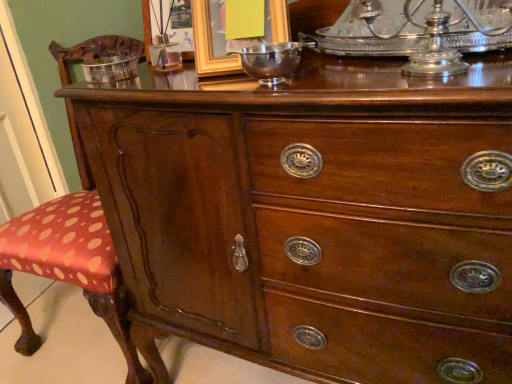
Image resolution: width=512 pixels, height=384 pixels. What are the coordinates of `vacant region in front of metallic gold picture frame at upper center, the second picture frame from the right` in the screenshot? It's located at (156, 84).